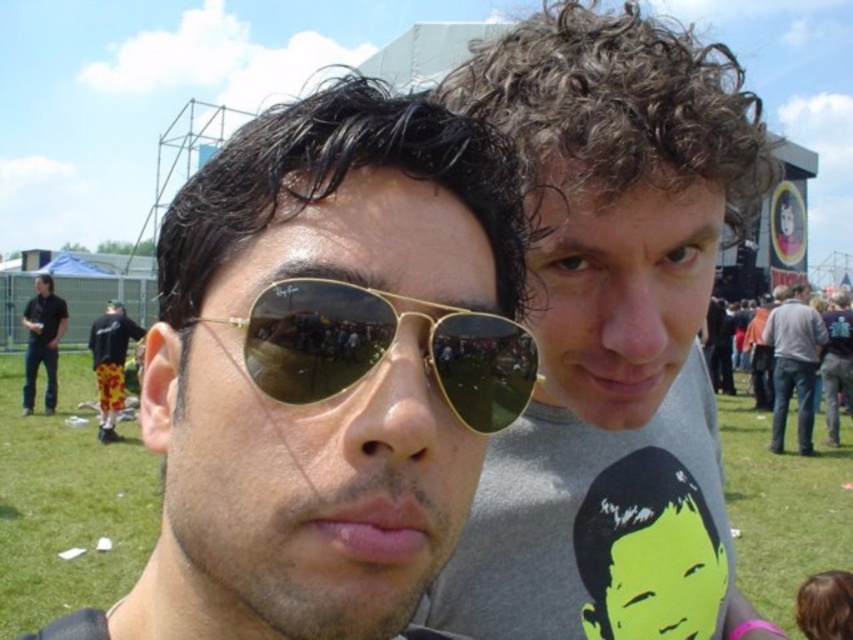
Which is above, neon yellow face at center or matte gold sunglasses at center?

matte gold sunglasses at center is higher up.

Does point (674, 564) come in front of point (47, 285)?

Yes, it is.

I want to click on neon yellow face at center, so click(662, 572).

Which is behind, point (775, 426) or point (843, 337)?

The point (775, 426) is more distant.

Who is positioned more to the left, gray cotton shirt at right or gray t-shirt at center?

gray cotton shirt at right is more to the left.

Is point (798, 291) in front of point (833, 406)?

That is False.

Identify the location of gray cotton shirt at right. (793, 364).

Between matte gray face at upper right and floral shorts at lower left, which one has more height?

floral shorts at lower left is taller.

Who is positioned more to the left, matte gray face at upper right or floral shorts at lower left?

floral shorts at lower left is more to the left.

The width and height of the screenshot is (853, 640). I want to click on matte gray face at upper right, so click(618, 285).